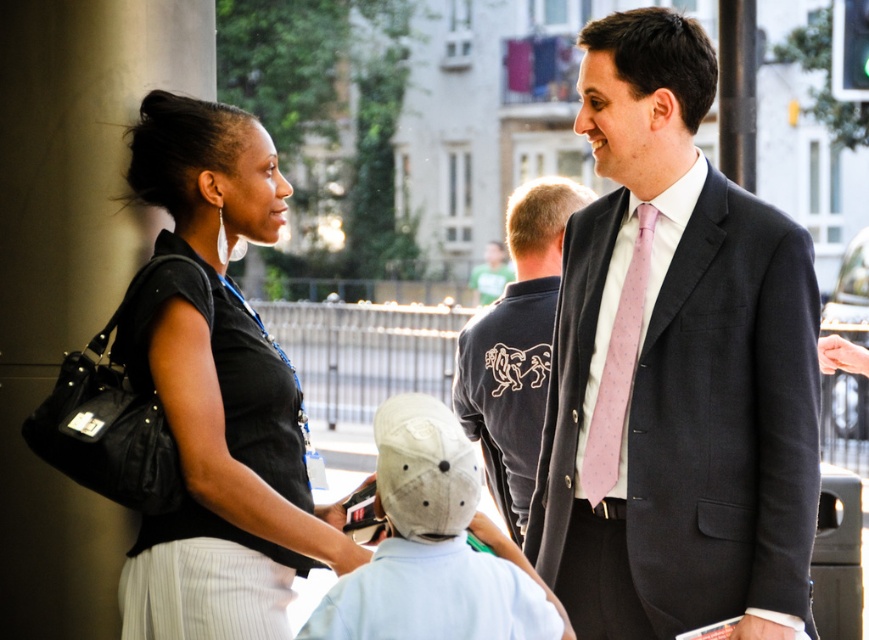
You are a photographer trying to capture a portrait of the dark blue shirt at center and the pink silk tie at right. Which object should you focus on first if you want to ensure both are in sharp focus?

The dark blue shirt at center is wider than the pink silk tie at right, so you should focus on the dark blue shirt at center first to ensure both are in sharp focus.

You are a photographer trying to capture a candid shot of the black fabric shirt at left and the man in dark suit on the right. If your camera can only focus on objects within a 0.5 unit radius from the center point, where should you aim your camera to ensure both subjects are within the focus range?

To ensure both the black fabric shirt at left and the man in dark suit on the right are within the 0.5 unit focus range, aim your camera at the midpoint between their positions. Since the black fabric shirt at left is at point (217, 392), the man in dark suit on the right would be positioned at a corresponding point to the right. The midpoint would be calculated by averaging their coordinates, ensuring both are within the 0.5 unit radius.